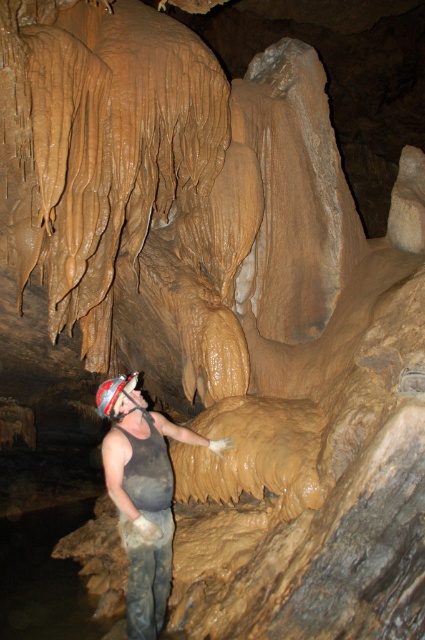
You are a caver preparing to take a photo of the cave formations. You have a camera with a focal length of 50mm and want to capture the matte gray tank top at center clearly. Considering the distance, should you adjust the focus to a near or far setting?

The matte gray tank top at center is 3.34 meters away from the camera. Since 3.34 meters is a moderate distance, you should set the focus to the far setting to ensure the matte gray tank top at center is in clear focus.

From the picture: You are a caver preparing to enter a narrow tunnel in the cave. You notice your matte gray tank top at center and your shiny silver helmet at center. Which item has a greater width that might affect your passage through the tunnel?

The matte gray tank top at center has a greater width than the shiny silver helmet at center, so it might be the item affecting your passage through the narrow tunnel.

You are a caver who needs to adjust your helmet light to see a formation ahead. Since you are holding a flashlight in your right hand, which item is easier to reach to make the adjustment, the matte gray tank top at center or the shiny silver helmet at center?

The shiny silver helmet at center is easier to reach because it is closer to the viewer than the matte gray tank top at center.